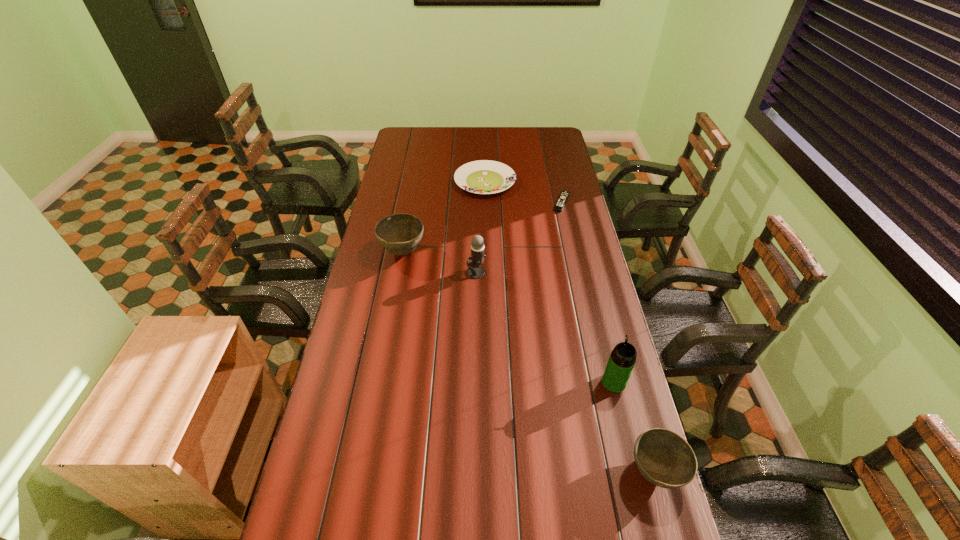
The width and height of the screenshot is (960, 540). What are the coordinates of `the taller bowl` in the screenshot? It's located at (399, 234).

Where is `the third tallest object`? the third tallest object is located at coordinates (399, 234).

The width and height of the screenshot is (960, 540). What are the coordinates of `the nearest object` in the screenshot? It's located at (665, 459).

Where is `the shorter bowl`? The image size is (960, 540). the shorter bowl is located at coordinates (665, 459).

The image size is (960, 540). Identify the location of salad plate. (483, 176).

Identify the location of the shortest object. The width and height of the screenshot is (960, 540). (564, 195).

The image size is (960, 540). I want to click on the fifth farthest object, so click(x=621, y=362).

Locate an element on the screen. This screenshot has width=960, height=540. microphone is located at coordinates (475, 271).

Find the location of a particular element. The width and height of the screenshot is (960, 540). free space located 0.270m on the right of the farther bowl is located at coordinates (493, 252).

Identify the location of vacant region located on the back of the nearer bowl. This screenshot has width=960, height=540. (626, 368).